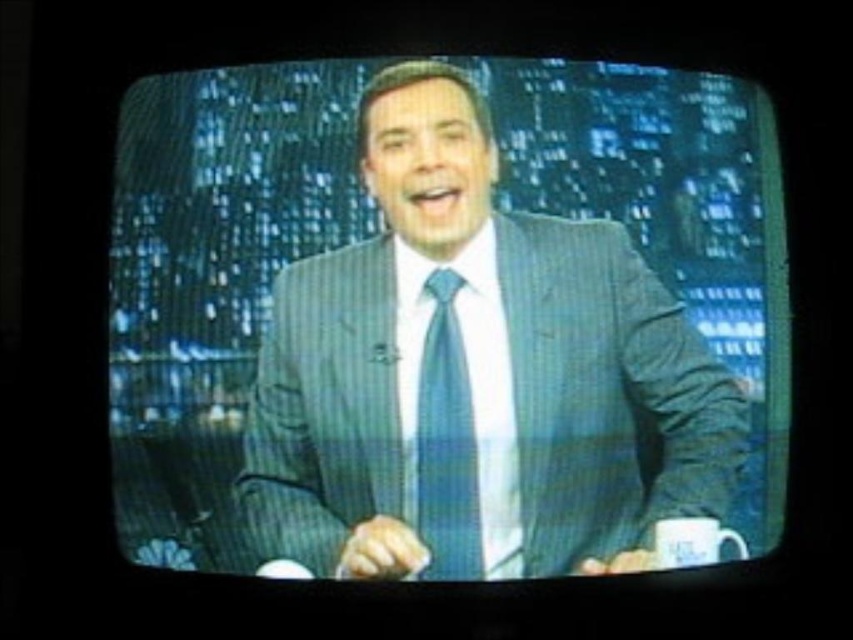
This screenshot has height=640, width=853. In order to click on blue pinstripe suit at center in this screenshot , I will do point(474,376).

This screenshot has height=640, width=853. What are the coordinates of `blue pinstripe suit at center` in the screenshot? It's located at (474, 376).

The height and width of the screenshot is (640, 853). Find the location of `blue pinstripe suit at center`. blue pinstripe suit at center is located at coordinates (474, 376).